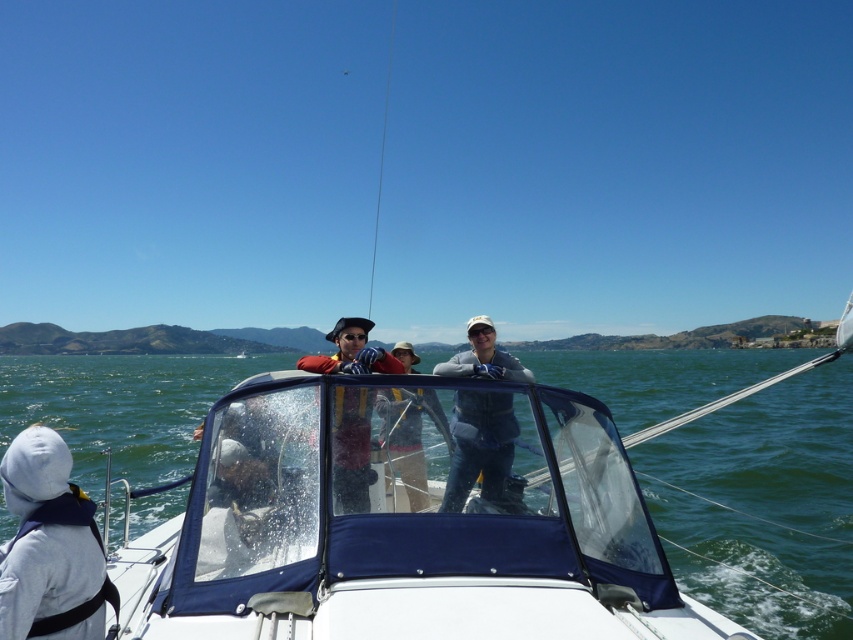
Between white fleece jacket at lower left and gray fabric jacket at center, which one is positioned higher?

gray fabric jacket at center is higher up.

Can you confirm if white fleece jacket at lower left is smaller than gray fabric jacket at center?

Yes.

Is point (91, 532) positioned behind point (480, 420)?

No, (91, 532) is in front of (480, 420).

The height and width of the screenshot is (640, 853). Identify the location of white fleece jacket at lower left. (49, 547).

Who is more distant from viewer, [509,444] or [345,332]?

Positioned behind is point [345,332].

From the picture: Does gray fabric jacket at center appear on the right side of matte orange life vest at center?

Indeed, gray fabric jacket at center is positioned on the right side of matte orange life vest at center.

Locate an element on the screen. gray fabric jacket at center is located at coordinates (482, 451).

Measure the distance from white fleece jacket at lower left to matte orange life vest at center.

The distance of white fleece jacket at lower left from matte orange life vest at center is 3.65 meters.

Is point (22, 470) behind point (347, 364)?

No, it is not.

Describe the element at coordinates (49, 547) in the screenshot. I see `white fleece jacket at lower left` at that location.

This screenshot has height=640, width=853. Identify the location of white fleece jacket at lower left. (49, 547).